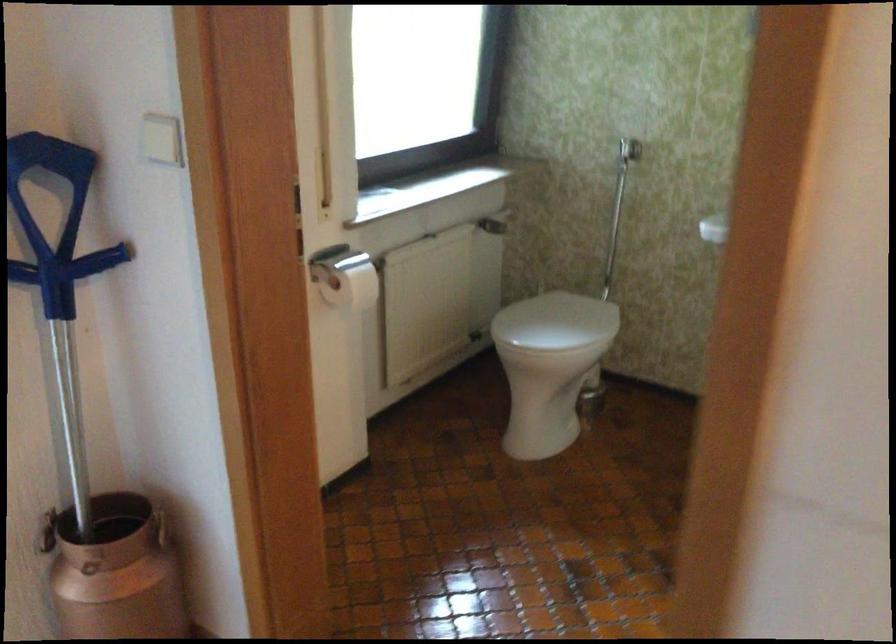
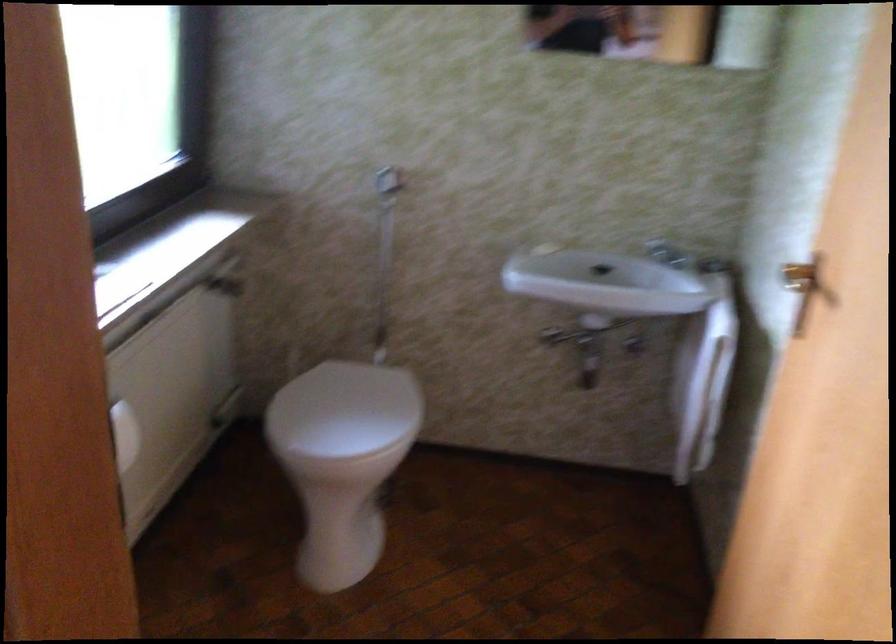
What movement of the cameraman would produce the second image?

The movement direction of the cameraman is left, forward.